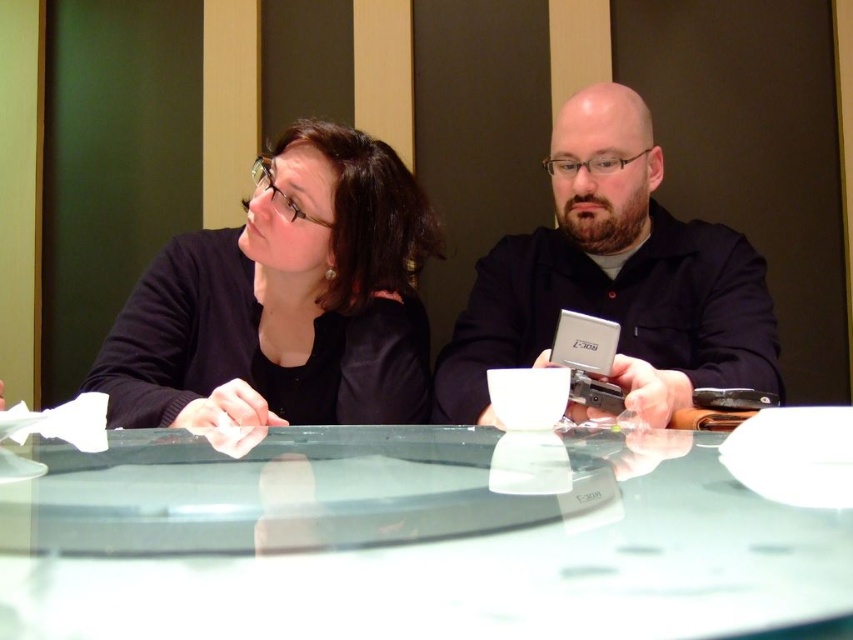
You are trying to place a small vase on the table between the transparent glass table at center and the matte black shirt at center. Which object should you place the vase on?

You should place the vase on the transparent glass table at center since it is the table, and the matte black shirt at center is likely part of a person, so the vase belongs on the table.

You are trying to place a new black matte laptop at center on the transparent glass table at center. Based on the scene description, will the laptop fit on the table?

The transparent glass table at center has a lesser width compared to black matte laptop at center, so the laptop will not fit on the table.